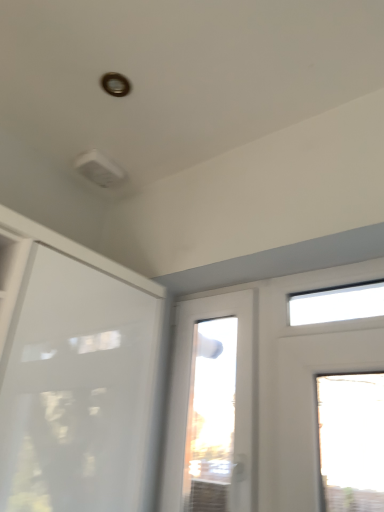
Question: Is white matte door at upper left shorter than white glossy door at center?

Choices:
 (A) no
 (B) yes

Answer: (B)

Question: Is white matte door at upper left wider than white glossy door at center?

Choices:
 (A) yes
 (B) no

Answer: (A)

Question: Is the depth of white matte door at upper left greater than that of white glossy door at center?

Choices:
 (A) no
 (B) yes

Answer: (A)

Question: From a real-world perspective, is white matte door at upper left physically below white glossy door at center?

Choices:
 (A) no
 (B) yes

Answer: (B)

Question: Does white matte door at upper left have a larger size compared to white glossy door at center?

Choices:
 (A) no
 (B) yes

Answer: (B)

Question: Is white matte door at upper left at the left side of white glossy door at center?

Choices:
 (A) yes
 (B) no

Answer: (A)

Question: From the image's perspective, is white glossy door at center located beneath white matte door at upper left?

Choices:
 (A) yes
 (B) no

Answer: (A)

Question: Are white glossy door at center and white matte door at upper left far apart?

Choices:
 (A) no
 (B) yes

Answer: (A)

Question: Can you confirm if white glossy door at center is positioned to the right of white matte door at upper left?

Choices:
 (A) yes
 (B) no

Answer: (A)

Question: Are white glossy door at center and white matte door at upper left making contact?

Choices:
 (A) yes
 (B) no

Answer: (B)

Question: Would you say white glossy door at center is outside white matte door at upper left?

Choices:
 (A) yes
 (B) no

Answer: (A)

Question: Is white glossy door at center taller than white matte door at upper left?

Choices:
 (A) no
 (B) yes

Answer: (B)

Question: From the image's perspective, is white glossy door at center positioned above or below white matte door at upper left?

Choices:
 (A) below
 (B) above

Answer: (A)